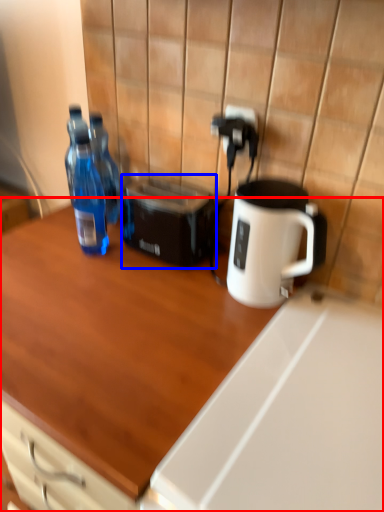
Question: Among these objects, which one is farthest to the camera, desk (highlighted by a red box) or toaster (highlighted by a blue box)?

Choices:
 (A) desk
 (B) toaster

Answer: (B)